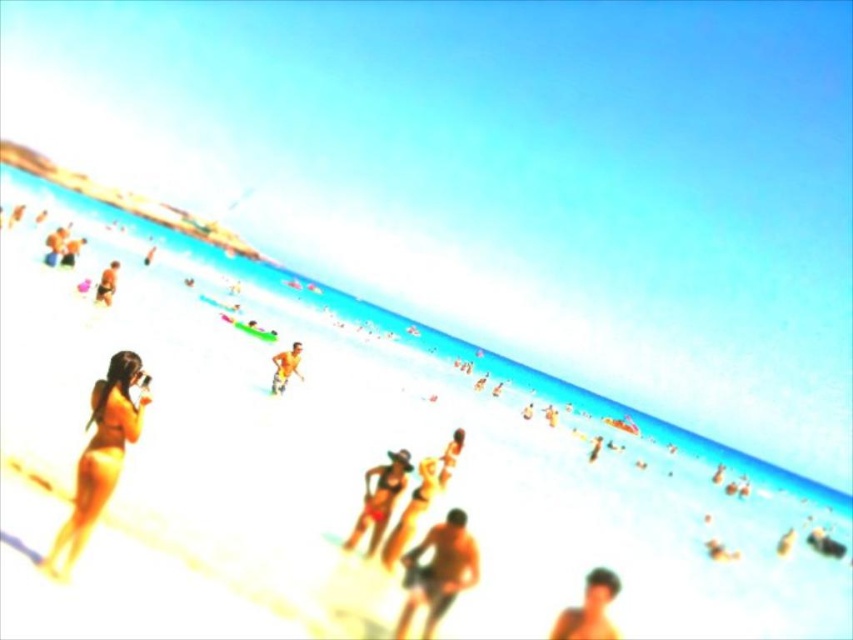
Locate an element on the screen. The height and width of the screenshot is (640, 853). smooth tan skin at center is located at coordinates (285, 368).

Which is more to the left, smooth tan skin at center or matte black swimsuit at upper left?

matte black swimsuit at upper left is more to the left.

What do you see at coordinates (285, 368) in the screenshot?
I see `smooth tan skin at center` at bounding box center [285, 368].

I want to click on smooth tan skin at center, so click(285, 368).

Does point (360, 536) lie behind point (457, 432)?

No.

Who is shorter, matte bikini at center or smooth skin person at center?

smooth skin person at center

Does point (407, 467) come closer to viewer compared to point (462, 442)?

Yes, point (407, 467) is closer to viewer.

Locate an element on the screen. matte bikini at center is located at coordinates (379, 499).

Can you confirm if smooth tan skin at lower right is positioned above smooth skin person at center?

Yes.

Between smooth tan skin at lower right and smooth skin person at center, which one is positioned lower?

smooth skin person at center

The height and width of the screenshot is (640, 853). What are the coordinates of `smooth tan skin at lower right` in the screenshot? It's located at (589, 609).